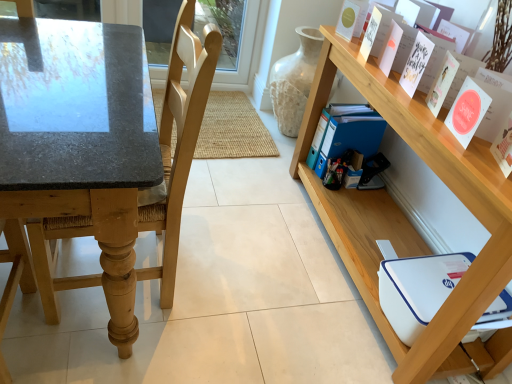
This screenshot has width=512, height=384. Find the location of `vacant area that lies between light wood chair at left and wooden shelf at upper right`. vacant area that lies between light wood chair at left and wooden shelf at upper right is located at coordinates (259, 266).